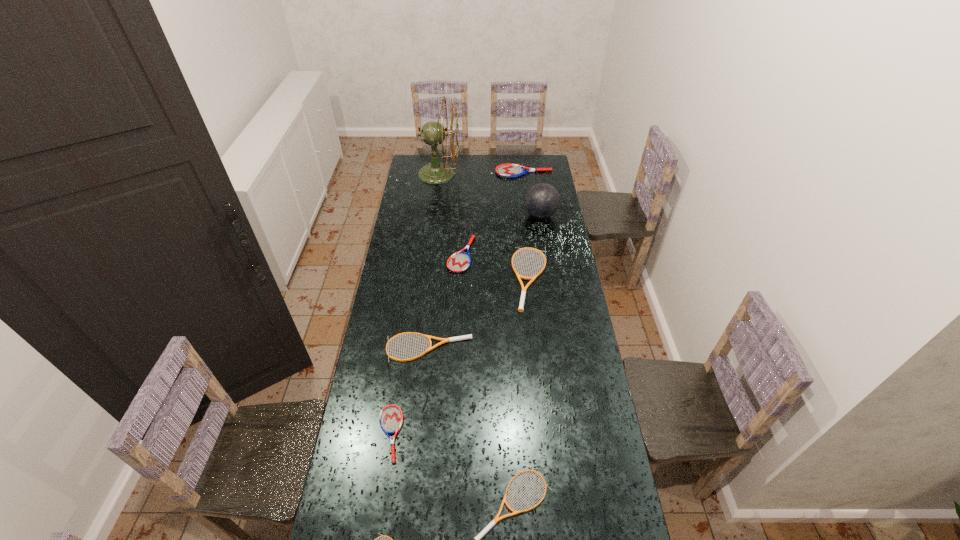
The width and height of the screenshot is (960, 540). Identify the location of the tallest object. tap(433, 133).

Where is `the third farthest object`? Image resolution: width=960 pixels, height=540 pixels. the third farthest object is located at coordinates pos(542,200).

Where is `the second tallest object`? the second tallest object is located at coordinates point(542,200).

Image resolution: width=960 pixels, height=540 pixels. In order to click on the biggest beige tennis racket in this screenshot , I will do point(523,292).

Locate an element on the screen. the biggest blue tennis racket is located at coordinates (504, 170).

Find the location of `the farthest tennis racket`. the farthest tennis racket is located at coordinates (504, 170).

I want to click on the fourth nearest object, so click(443, 340).

Identify the location of the third nearest beige tennis racket. The image size is (960, 540). (443, 340).

Locate an element on the screen. The width and height of the screenshot is (960, 540). the second nearest blue tennis racket is located at coordinates (460, 261).

Locate an element on the screen. the second biggest blue tennis racket is located at coordinates (460, 261).